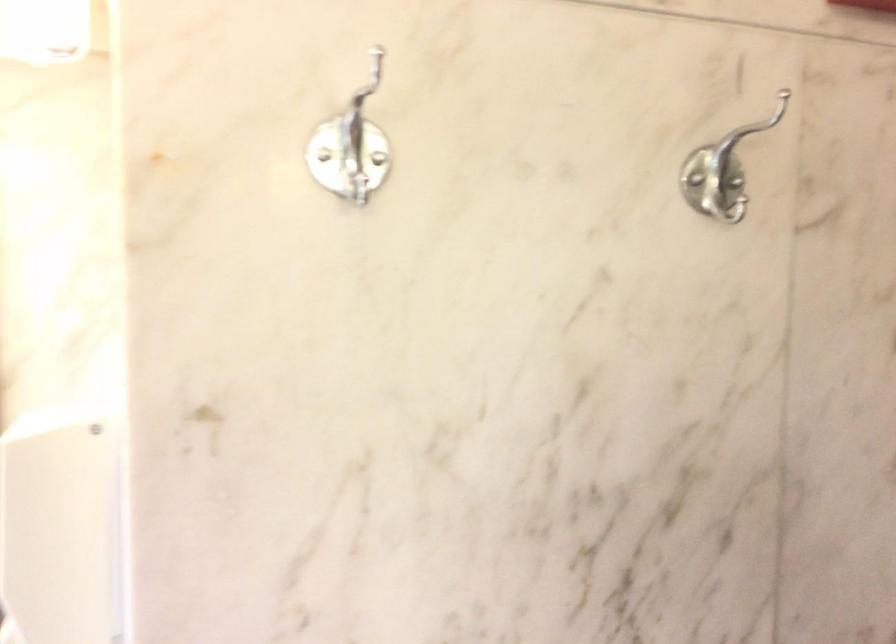
Question: The first image is from the beginning of the video and the second image is from the end. How did the camera likely rotate when shooting the video?

Choices:
 (A) Left
 (B) Right
 (C) Up
 (D) Down

Answer: (A)